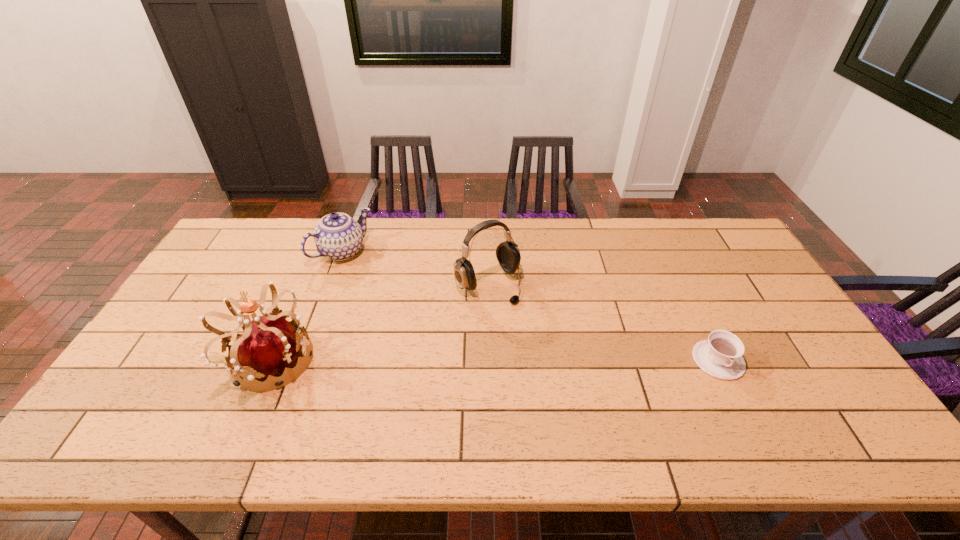
In order to click on vacant space located 0.170m at the spout of the chinaware in this screenshot , I will do `click(386, 292)`.

The width and height of the screenshot is (960, 540). I want to click on free space located 0.360m at the spout of the chinaware, so [x=423, y=326].

What are the coordinates of `object located in the far edge section of the desktop` in the screenshot? It's located at (337, 236).

This screenshot has height=540, width=960. Find the location of `object that is positioned at the near edge`. object that is positioned at the near edge is located at coordinates [270, 344].

In the image, there is a desktop. Identify the location of vacant area at the far edge. (411, 253).

In the image, there is a desktop. At what (x,y) coordinates should I click in order to perform the action: click on free region at the near edge. Please return your answer as a coordinate pair (x, y). Image resolution: width=960 pixels, height=540 pixels. Looking at the image, I should click on (505, 399).

In the image, there is a desktop. At what (x,y) coordinates should I click in order to perform the action: click on vacant space at the left edge. Please return your answer as a coordinate pair (x, y). This screenshot has height=540, width=960. Looking at the image, I should click on (193, 294).

Where is `vacant space at the right edge of the desktop`? This screenshot has height=540, width=960. vacant space at the right edge of the desktop is located at coordinates (765, 321).

In the image, there is a desktop. Where is `vacant space at the far right corner`? This screenshot has width=960, height=540. vacant space at the far right corner is located at coordinates (704, 219).

At what (x,y) coordinates should I click in order to perform the action: click on free spot between the second shortest object and the tiara. Please return your answer as a coordinate pair (x, y). The image size is (960, 540). Looking at the image, I should click on (306, 306).